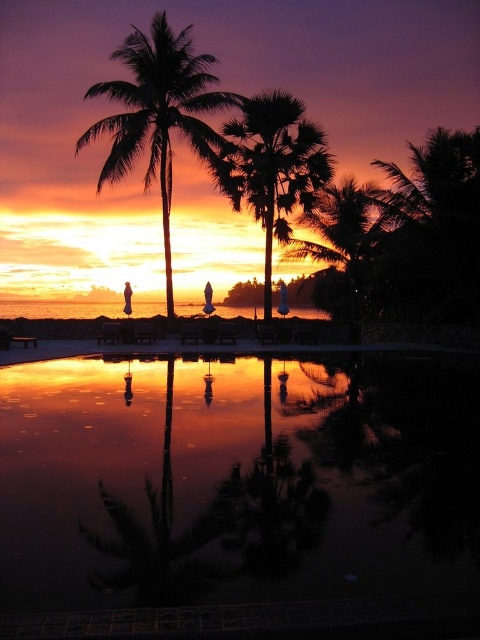
You are standing at the edge of the pool and want to take a photo of the green leafy palm tree at center. The camera you have can focus on objects up to 100 feet away. Will the palm tree be in focus?

The green leafy palm tree at center is 86.05 feet away from viewer, so yes, the palm tree will be in focus since it is within the camera focus range of 100 feet.

You are a guest at the resort and want to take a photo of the sunset with the silhouette leafy palm at center in the foreground and the reflective glass pool at center in the background. Can you position yourself so that the palm is in front of the pool in the photo?

The reflective glass pool at center is positioned under silhouette leafy palm at center, so yes, you can position yourself so that the silhouette leafy palm at center appears in front of the reflective glass pool at center in the photo.